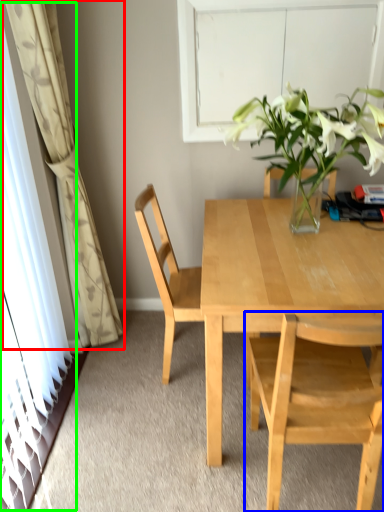
Question: Which is farther away from curtain (highlighted by a red box)? chair (highlighted by a blue box) or glass door (highlighted by a green box)?

Choices:
 (A) chair
 (B) glass door

Answer: (A)